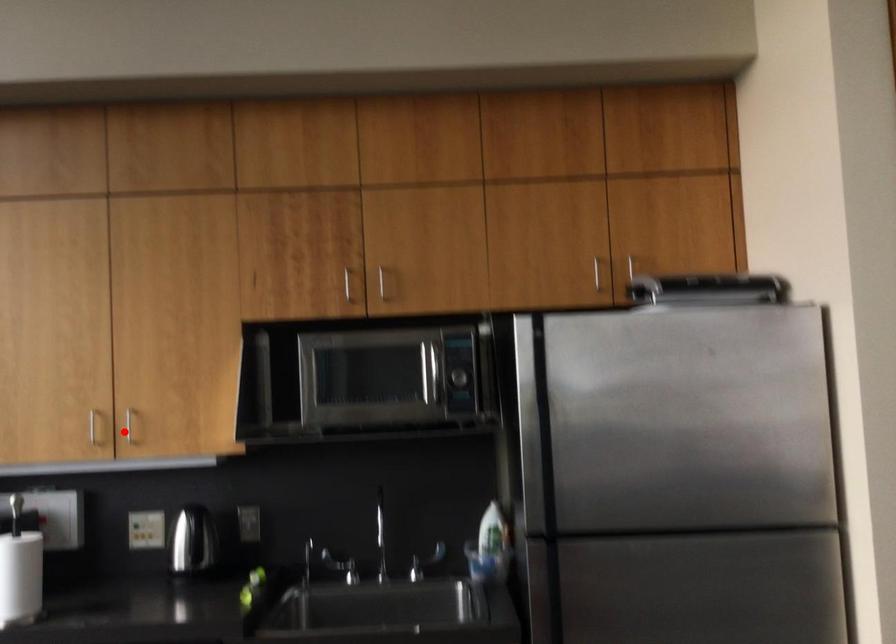
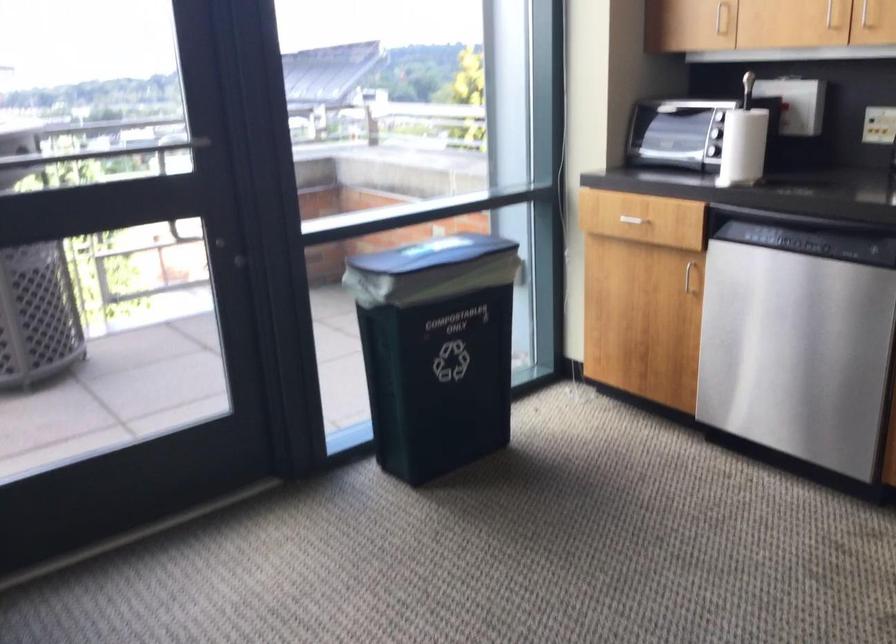
The point at the highlighted location is marked in the first image. Where is the corresponding point in the second image?

(865, 15)